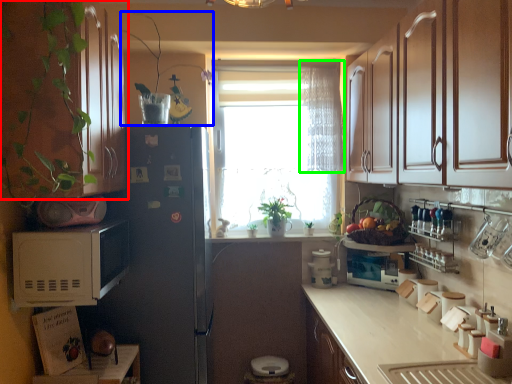
Question: Estimate the real-world distances between objects in this image. Which object is closer to cabinetry (highlighted by a red box), plant (highlighted by a blue box) or curtain (highlighted by a green box)?

Choices:
 (A) plant
 (B) curtain

Answer: (A)